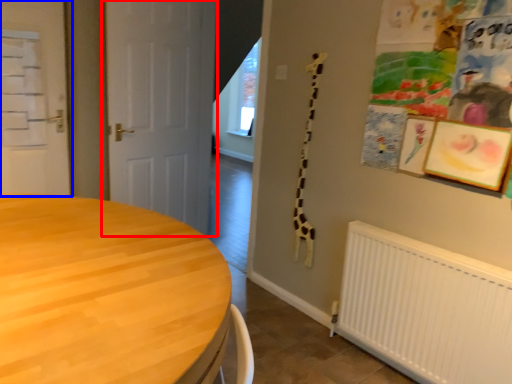
Question: Among these objects, which one is farthest to the camera, door (highlighted by a red box) or door (highlighted by a blue box)?

Choices:
 (A) door
 (B) door

Answer: (A)